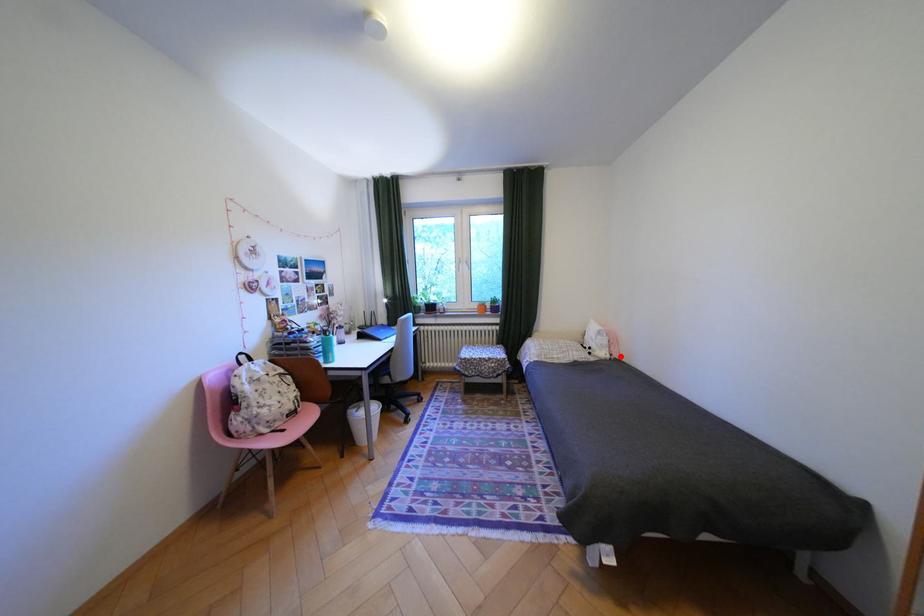
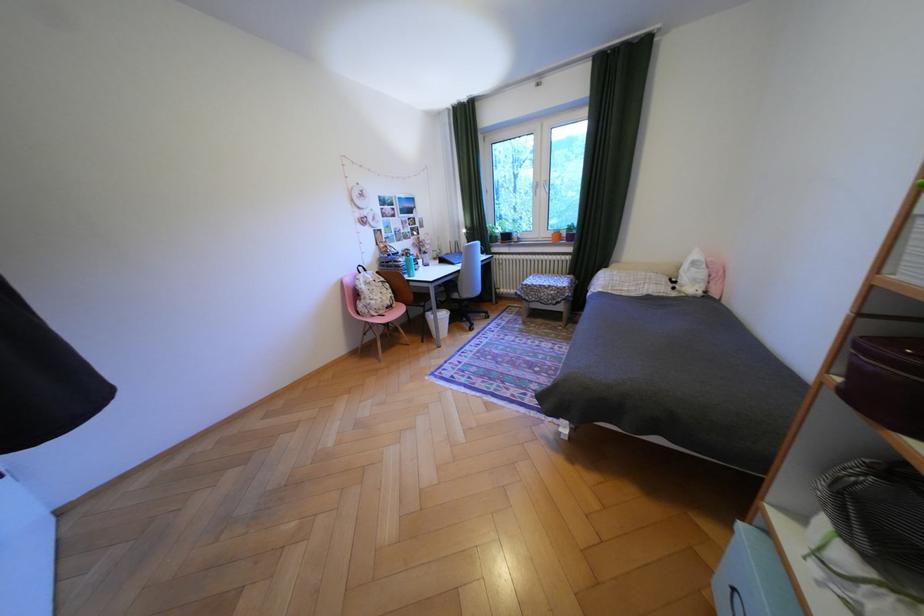
Question: I am providing you with two images of the same scene from different viewpoints. A red point is shown in image1. For the corresponding object point in image2, is it positioned nearer or farther from the camera?

Choices:
 (A) Nearer
 (B) Farther

Answer: (A)